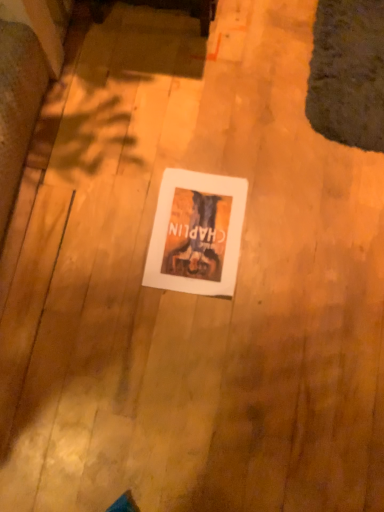
Identify the location of vacant space in white paper poster at center (from a real-world perspective). (198, 236).